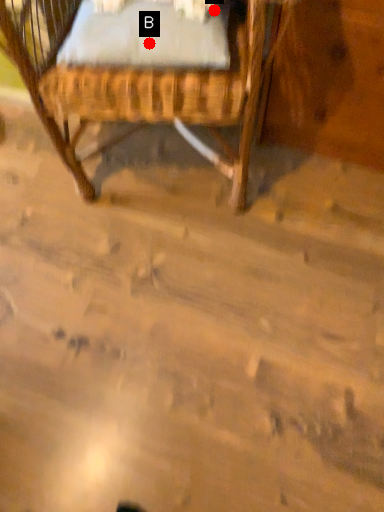
Question: Two points are circled on the image, labeled by A and B beside each circle. Which point is closer to the camera taking this photo?

Choices:
 (A) A is closer
 (B) B is closer

Answer: (B)